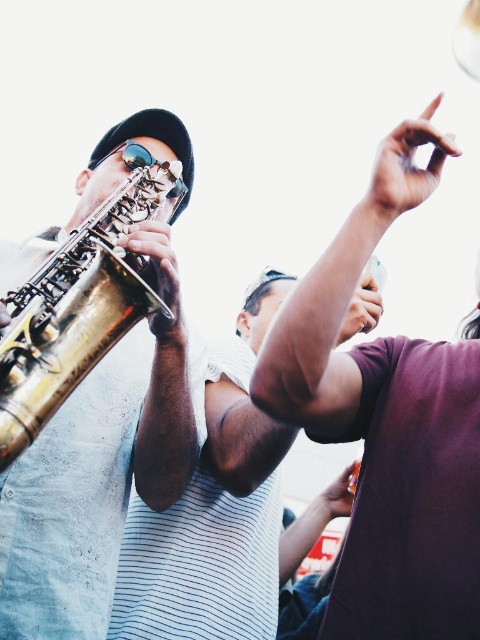
Is dark purple shirt at upper right smaller than gold polished trumpet at left?

Actually, dark purple shirt at upper right might be larger than gold polished trumpet at left.

Is the position of dark purple shirt at upper right less distant than that of gold polished trumpet at left?

Yes.

Which is behind, point (387, 577) or point (83, 344)?

Positioned behind is point (83, 344).

Find the location of `dark purple shirt at upper right`. dark purple shirt at upper right is located at coordinates (387, 422).